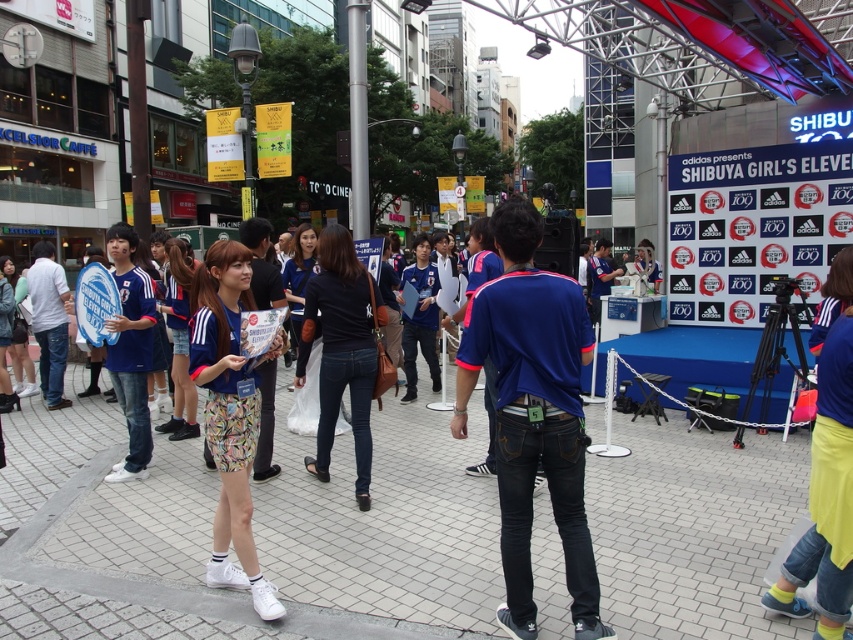
Question: Does blue denim jeans at center appear on the left side of blue denim jeans at left?

Choices:
 (A) yes
 (B) no

Answer: (B)

Question: Among these objects, which one is farthest from the camera?

Choices:
 (A) blue jersey at center
 (B) dark blue denim jeans at center
 (C) blue denim jeans at left
 (D) white cotton shirt at left

Answer: (D)

Question: Which of the following is the closest to the observer?

Choices:
 (A) dark blue denim jeans at center
 (B) blue jersey at center
 (C) white cotton shirt at left

Answer: (B)

Question: Is white tile pavement at center further to camera compared to blue jersey at center?

Choices:
 (A) yes
 (B) no

Answer: (A)

Question: Does blue denim jeans at center appear over blue jersey at center?

Choices:
 (A) yes
 (B) no

Answer: (A)

Question: Among these objects, which one is farthest from the camera?

Choices:
 (A) white cotton shirt at left
 (B) white tile pavement at center

Answer: (A)